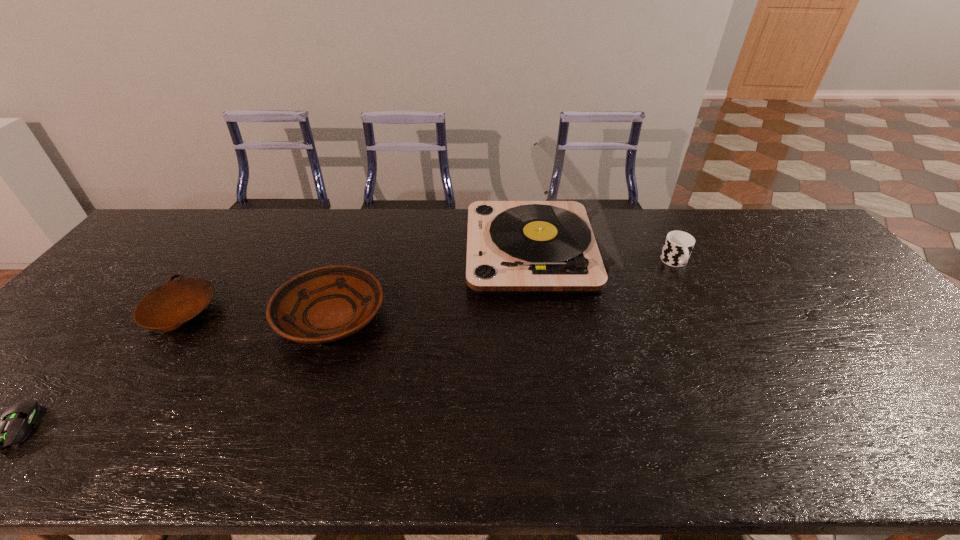
Locate an element on the screen. The width and height of the screenshot is (960, 540). vacant region located 0.080m with the tonearm facing the front of the record player is located at coordinates (443, 251).

I want to click on free space located 0.230m on the side of the cup with the handle, so click(711, 330).

This screenshot has height=540, width=960. I want to click on vacant position located on the left of the right plate, so pyautogui.click(x=174, y=316).

This screenshot has width=960, height=540. Identify the location of free point located on the left of the shorter plate. (83, 312).

Locate an element on the screen. Image resolution: width=960 pixels, height=540 pixels. object situated at the far edge is located at coordinates (564, 245).

Image resolution: width=960 pixels, height=540 pixels. I want to click on free space at the far edge, so click(x=336, y=218).

The height and width of the screenshot is (540, 960). I want to click on vacant space at the near edge of the desktop, so click(x=357, y=430).

Where is `vacant space at the left edge of the desktop`? The width and height of the screenshot is (960, 540). vacant space at the left edge of the desktop is located at coordinates (42, 382).

Where is `vacant region at the right edge of the desktop`? vacant region at the right edge of the desktop is located at coordinates (855, 334).

I want to click on vacant space at the far left corner, so click(x=171, y=241).